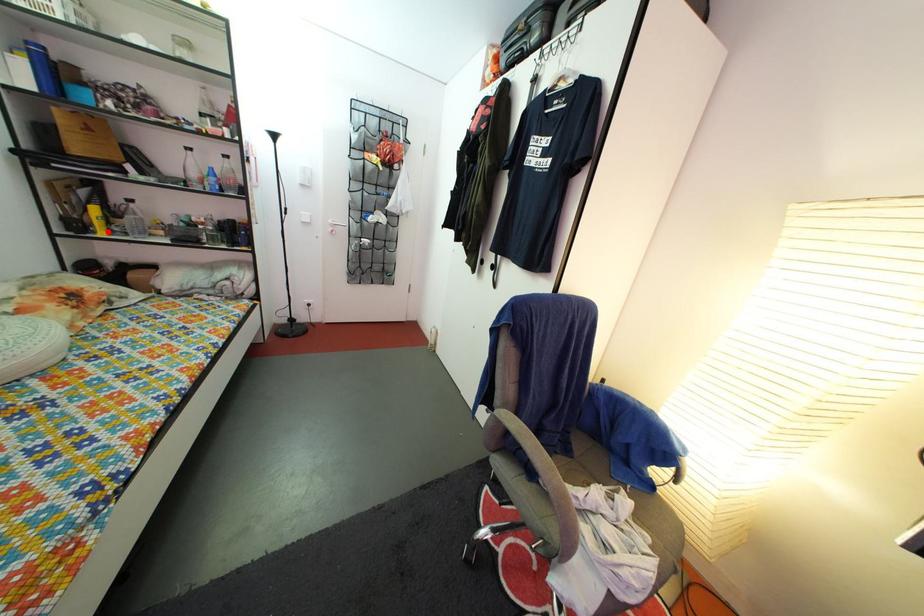
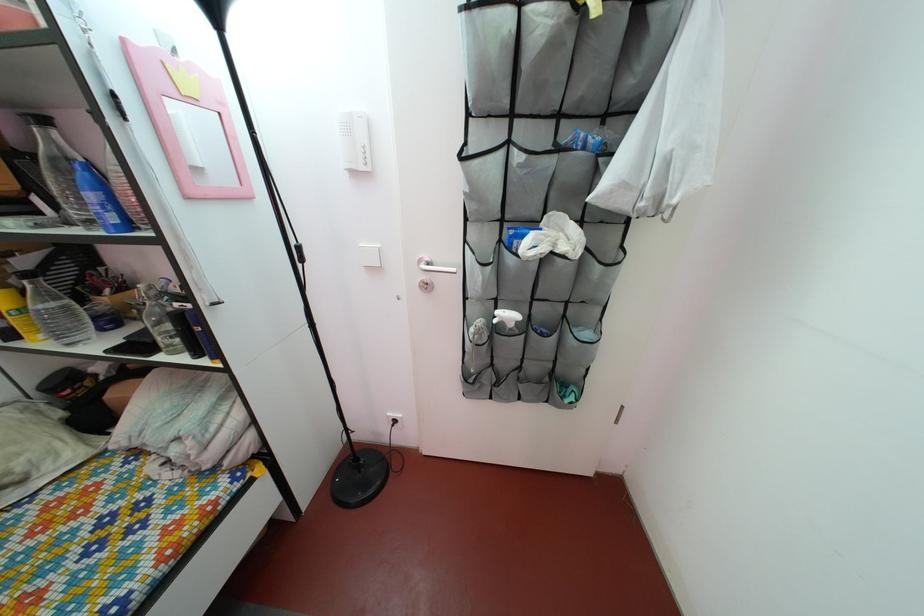
Question: I am providing you with two images of the same scene from different viewpoints. Image1 has a red point marked. In image2, the corresponding 3D location appears at what relative position? Reply with the corresponding letter.

Choices:
 (A) Closer
 (B) Farther

Answer: (A)